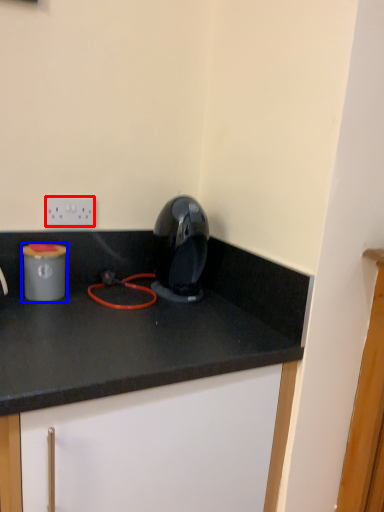
Question: Which point is closer to the camera, electric outlet (highlighted by a red box) or appliance (highlighted by a blue box)?

Choices:
 (A) electric outlet
 (B) appliance

Answer: (B)